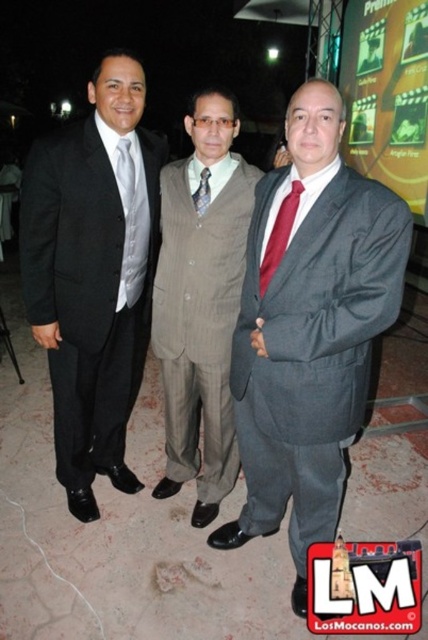
You are a photographer adjusting the lighting for a group photo. You notice two ties in the center of the image, a matte red tie at center and a matte white tie at center. Which tie is positioned lower on the person wearing them?

The matte red tie at center is below the matte white tie at center, so the matte red tie at center is positioned lower.

You are a photographer trying to capture a closeup of the matte gray suit at center and the matte white tie at center. Given their sizes, which one will require you to move closer to get a detailed shot?

The matte white tie at center is smaller than the matte gray suit at center, so you will need to move closer to the matte white tie at center to capture its details.

You are a photographer adjusting your camera settings to focus on the red tie at center. The camera has a focus point at coordinate point (279,236). Which man should you adjust the focus to capture the red tie at center?

The point (279,236) indicates the matte red tie at center, which belongs to the man on the right wearing a dark gray suit with a white shirt and a red tie. Adjust the focus to capture the red tie at center on the man on the right.